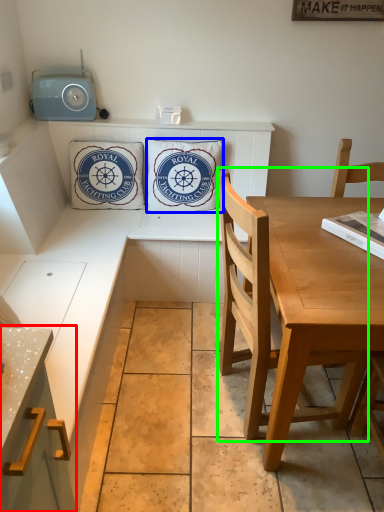
Question: Which is nearer to the cabinetry (highlighted by a red box)? pillow (highlighted by a blue box) or chair (highlighted by a green box).

Choices:
 (A) pillow
 (B) chair

Answer: (B)